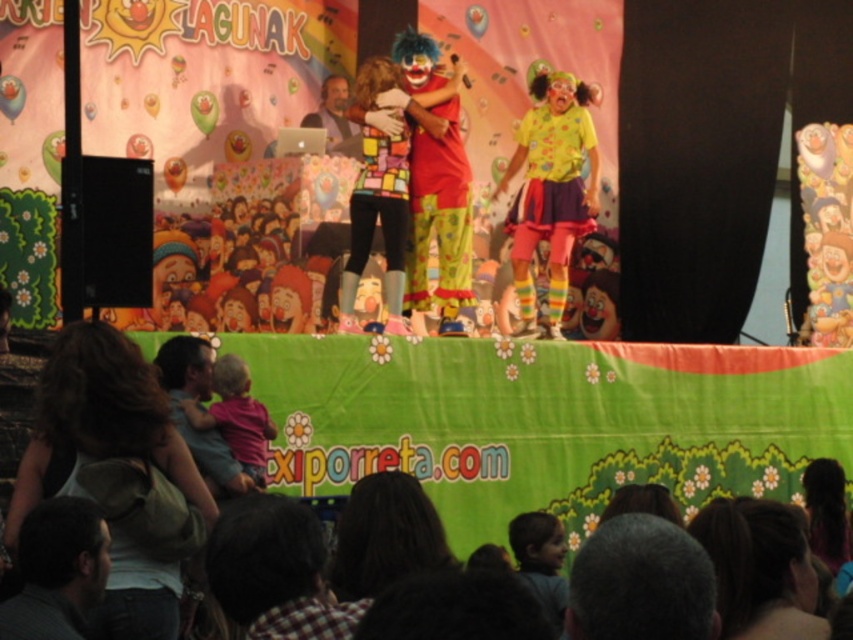
Does yellow polka dot shirt at center appear under matte gray laptop at center?

Correct, yellow polka dot shirt at center is located below matte gray laptop at center.

Is yellow polka dot shirt at center wider than matte gray laptop at center?

Yes.

I want to click on yellow polka dot shirt at center, so click(550, 192).

The image size is (853, 640). Identify the location of yellow polka dot shirt at center. [x=550, y=192].

Is dark brown hair at lower left below matte gray laptop at center?

Correct, dark brown hair at lower left is located below matte gray laptop at center.

Is dark brown hair at lower left wider than matte gray laptop at center?

Correct, the width of dark brown hair at lower left exceeds that of matte gray laptop at center.

Locate an element on the screen. The image size is (853, 640). dark brown hair at lower left is located at coordinates (99, 422).

I want to click on dark brown hair at lower left, so click(x=99, y=422).

Does yellow polka dot shirt at center come in front of gray fabric shirt at lower left?

No, yellow polka dot shirt at center is further to the viewer.

Which of these two, yellow polka dot shirt at center or gray fabric shirt at lower left, stands taller?

With more height is yellow polka dot shirt at center.

Where is `yellow polka dot shirt at center`? Image resolution: width=853 pixels, height=640 pixels. yellow polka dot shirt at center is located at coordinates (550, 192).